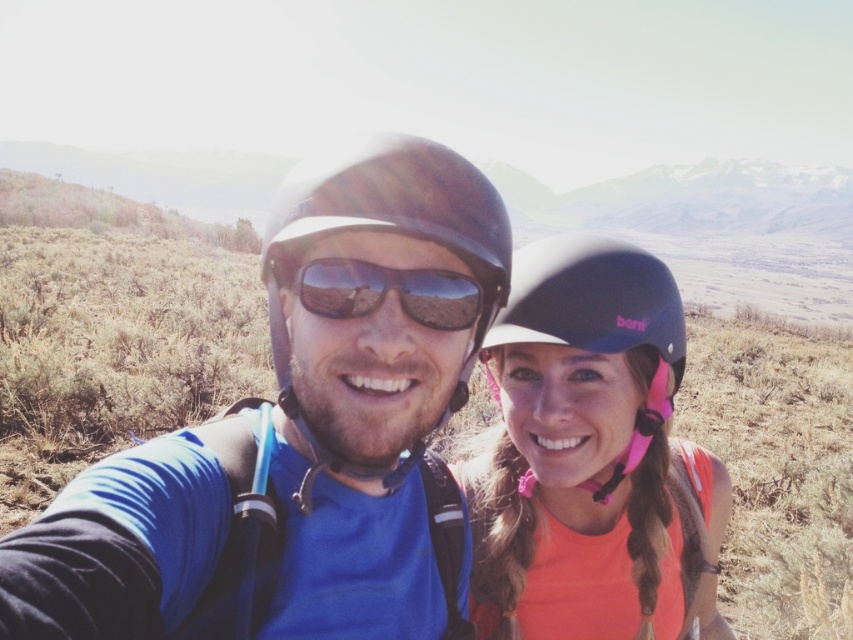
In the scene shown: You are a photographer trying to capture both the matte blue helmet at left and the matte black sunglasses at center in a single frame. Given their sizes, which object would require you to adjust your camera angle more to ensure both are fully visible?

The matte blue helmet at left requires more adjustment because it is wider than the matte black sunglasses at center.

You are designing a storage box that needs to accommodate both the matte blue helmet at right and the matte black sunglasses at center. Based on the spatial relationship between them, which item should you prioritize in terms of width when planning the box dimensions?

The matte blue helmet at right might be wider than matte black sunglasses at center, so you should prioritize the width required for the matte blue helmet at right to ensure both items fit properly.

You are a photographer trying to capture the matte blue helmet at right. The camera you are using has a focal point set at coordinate point (590, 458). Will this coordinate help you focus on the matte blue helmet at right?

Yes, the coordinate point (590, 458) corresponds to the matte blue helmet at right, so setting the focal point there will help focus on it.